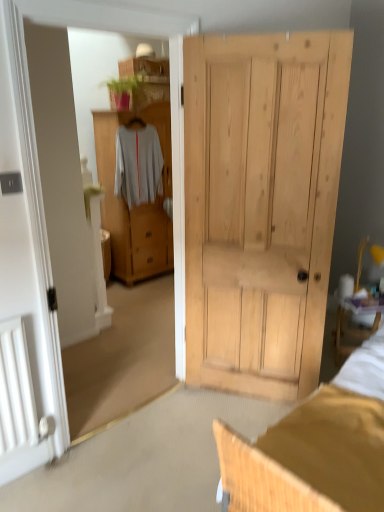
I want to click on white matte sweater at center, so click(x=138, y=165).

Describe the element at coordinates (138, 165) in the screenshot. The width and height of the screenshot is (384, 512). I see `white matte sweater at center` at that location.

What is the approximate height of white matte sweater at center?

It is 33.20 inches.

What is the approximate width of light brown wood cabinet at center?

51.52 centimeters.

This screenshot has width=384, height=512. What do you see at coordinates (135, 206) in the screenshot?
I see `light brown wood cabinet at center` at bounding box center [135, 206].

What is the approximate height of light brown wood cabinet at center?

It is 5.40 feet.

The image size is (384, 512). I want to click on light brown wood cabinet at center, so click(x=135, y=206).

The image size is (384, 512). What are the coordinates of `white matte sweater at center` in the screenshot? It's located at (138, 165).

Is light brown wood cabinet at center to the right of white matte sweater at center from the viewer's perspective?

Yes.

Between light brown wood cabinet at center and white matte sweater at center, which one is positioned in front?

white matte sweater at center is closer to the camera.

Which point is more distant from viewer, (111, 136) or (115, 181)?

Positioned behind is point (115, 181).

From the image's perspective, between light brown wood cabinet at center and white matte sweater at center, which one is located above?

From the image's view, white matte sweater at center is above.

From a real-world perspective, is light brown wood cabinet at center positioned over white matte sweater at center based on gravity?

No, from a real-world perspective, light brown wood cabinet at center is not on top of white matte sweater at center.

Consider the image. Does light brown wood cabinet at center have a lesser width compared to white matte sweater at center?

No, light brown wood cabinet at center is not thinner than white matte sweater at center.

Is light brown wood cabinet at center taller or shorter than white matte sweater at center?

In the image, light brown wood cabinet at center appears to be taller than white matte sweater at center.

Considering the relative sizes of light brown wood cabinet at center and white matte sweater at center in the image provided, is light brown wood cabinet at center smaller than white matte sweater at center?

No.

Would you say white matte sweater at center is part of light brown wood cabinet at center's contents?

Yes, light brown wood cabinet at center is surrounding white matte sweater at center.

Is light brown wood cabinet at center in contact with white matte sweater at center?

They are not placed beside each other.

Could you tell me if light brown wood cabinet at center is facing white matte sweater at center?

Yes, light brown wood cabinet at center is facing white matte sweater at center.

How different are the orientations of light brown wood cabinet at center and white matte sweater at center in degrees?

light brown wood cabinet at center and white matte sweater at center are facing 0.00826 degrees away from each other.

You are a GUI agent. You are given a task and a screenshot of the screen. Output one action in this format:
    pyautogui.click(x=<x>, y=<y>)
    Task: Click on the cabinetry lying below the white matte sweater at center (from the image's perspective)
    Image resolution: width=384 pixels, height=512 pixels.
    Given the screenshot: What is the action you would take?
    pyautogui.click(x=135, y=206)

Which object is positioned more to the left, white matte sweater at center or light brown wood cabinet at center?

white matte sweater at center is more to the left.

Which object is more forward, white matte sweater at center or light brown wood cabinet at center?

white matte sweater at center is closer to the camera.

Is point (153, 180) positioned behind point (120, 233)?

No.

In the scene shown: From the image's perspective, which one is positioned higher, white matte sweater at center or light brown wood cabinet at center?

white matte sweater at center.

Looking at this image, from a real-world perspective, relative to light brown wood cabinet at center, is white matte sweater at center vertically above or below?

From a real-world perspective, white matte sweater at center is physically above light brown wood cabinet at center.

Which of these two, white matte sweater at center or light brown wood cabinet at center, is thinner?

Thinner between the two is white matte sweater at center.

Is white matte sweater at center taller or shorter than light brown wood cabinet at center?

Clearly, white matte sweater at center is shorter compared to light brown wood cabinet at center.

Which of these two, white matte sweater at center or light brown wood cabinet at center, is smaller?

Smaller between the two is white matte sweater at center.

Choose the correct answer: Is white matte sweater at center inside light brown wood cabinet at center or outside it?

white matte sweater at center is located inside light brown wood cabinet at center.

Is white matte sweater at center in contact with light brown wood cabinet at center?

white matte sweater at center is not next to light brown wood cabinet at center, and they're not touching.

Could you tell me if white matte sweater at center is facing light brown wood cabinet at center?

Yes, white matte sweater at center is facing light brown wood cabinet at center.

At what (x,y) coordinates should I click in order to perform the action: click on clothing positioned vertically above the light brown wood cabinet at center (from a real-world perspective). Please return your answer as a coordinate pair (x, y). Image resolution: width=384 pixels, height=512 pixels. Looking at the image, I should click on (138, 165).

Find the location of a particular element. The width and height of the screenshot is (384, 512). cabinetry below the white matte sweater at center (from a real-world perspective) is located at coordinates (135, 206).

Locate an element on the screen. The width and height of the screenshot is (384, 512). clothing lying on the left of light brown wood cabinet at center is located at coordinates (138, 165).